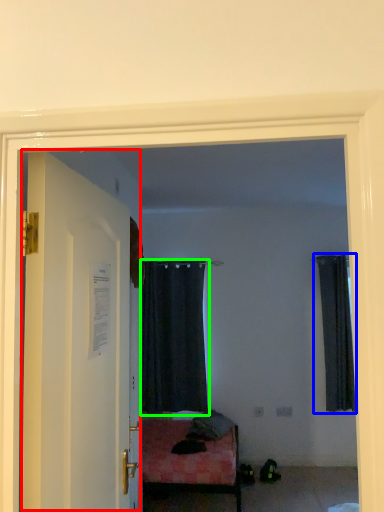
Question: Which object is positioned closest to door (highlighted by a red box)? Select from curtain (highlighted by a blue box) and curtain (highlighted by a green box).

Choices:
 (A) curtain
 (B) curtain

Answer: (B)